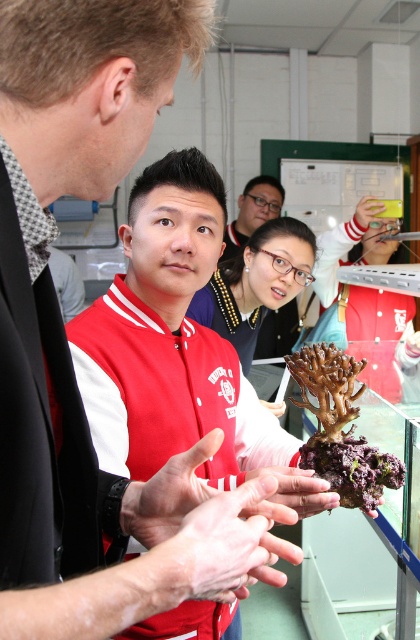
Who is positioned more to the left, matte white hand at center or matte black hand at center?

From the viewer's perspective, matte black hand at center appears more on the left side.

Find the location of a particular element. This screenshot has width=420, height=640. matte white hand at center is located at coordinates (412, 342).

Image resolution: width=420 pixels, height=640 pixels. What are the coordinates of `matte white hand at center` in the screenshot? It's located at (412, 342).

Does point (362, 208) lie behind point (414, 342)?

Yes, point (362, 208) is farther from viewer.

What do you see at coordinates (367, 209) in the screenshot? The width and height of the screenshot is (420, 640). I see `matte yellow hand at center` at bounding box center [367, 209].

Where is `matte yellow hand at center`? The height and width of the screenshot is (640, 420). matte yellow hand at center is located at coordinates (367, 209).

Is matte red jacket at center below matte yellow hand at center?

Indeed, matte red jacket at center is positioned under matte yellow hand at center.

Who is more distant from viewer, (267, 508) or (375, 209)?

Point (375, 209)

Locate an element on the screen. matte red jacket at center is located at coordinates (67, 342).